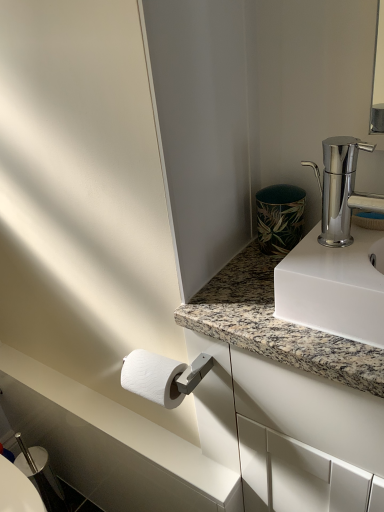
Identify the location of silver metallic bidet at lower left. The image size is (384, 512). (17, 490).

What do you see at coordinates (110, 445) in the screenshot? I see `white marble countertop at lower left` at bounding box center [110, 445].

Where is `green leaf-patterned ceramic at upper right`? The image size is (384, 512). green leaf-patterned ceramic at upper right is located at coordinates (279, 218).

Choose the correct answer: Is white marble countertop at lower left inside silver metallic bidet at lower left or outside it?

white marble countertop at lower left cannot be found inside silver metallic bidet at lower left.

Does white marble countertop at lower left have a greater height compared to silver metallic bidet at lower left?

Incorrect, the height of white marble countertop at lower left is not larger of that of silver metallic bidet at lower left.

I want to click on counter top positioned vertically above the silver metallic bidet at lower left (from a real-world perspective), so click(x=110, y=445).

From a real-world perspective, who is located higher, white marble countertop at lower left or silver metallic bidet at lower left?

white marble countertop at lower left.

From the image's perspective, is white textured toilet paper at lower left above green leaf-patterned ceramic at upper right?

Actually, white textured toilet paper at lower left appears below green leaf-patterned ceramic at upper right in the image.

Does white textured toilet paper at lower left have a greater width compared to green leaf-patterned ceramic at upper right?

Yes.

Is white textured toilet paper at lower left smaller than green leaf-patterned ceramic at upper right?

Yes, white textured toilet paper at lower left is smaller than green leaf-patterned ceramic at upper right.

Locate an element on the screen. The image size is (384, 512). toilet paper above the granite at upper right (from the image's perspective) is located at coordinates (153, 377).

Is white textured toilet paper at lower left located outside granite at upper right?

Yes, white textured toilet paper at lower left is outside of granite at upper right.

In the scene shown: Does white textured toilet paper at lower left have a greater height compared to granite at upper right?

Incorrect, the height of white textured toilet paper at lower left is not larger of that of granite at upper right.

Considering the relative sizes of white textured toilet paper at lower left and granite at upper right in the image provided, is white textured toilet paper at lower left bigger than granite at upper right?

Incorrect, white textured toilet paper at lower left is not larger than granite at upper right.

Is point (294, 186) positioned before point (127, 360)?

No, (294, 186) is further to viewer.

What's the angular difference between green leaf-patterned ceramic at upper right and white textured toilet paper at lower left's facing directions?

The angle between the facing direction of green leaf-patterned ceramic at upper right and the facing direction of white textured toilet paper at lower left is 90 degrees.

Considering the relative positions of green leaf-patterned ceramic at upper right and white textured toilet paper at lower left in the image provided, is green leaf-patterned ceramic at upper right behind white textured toilet paper at lower left?

Yes, green leaf-patterned ceramic at upper right is further from the camera.

Is green leaf-patterned ceramic at upper right positioned with its back to white textured toilet paper at lower left?

green leaf-patterned ceramic at upper right does not have its back to white textured toilet paper at lower left.

This screenshot has height=512, width=384. Find the location of `appliance below the polished chrome faucet at upper right (from the image's perspective)`. appliance below the polished chrome faucet at upper right (from the image's perspective) is located at coordinates click(x=279, y=218).

Is green leaf-patterned ceramic at upper right directly adjacent to polished chrome faucet at upper right?

No, green leaf-patterned ceramic at upper right is not touching polished chrome faucet at upper right.

In terms of width, does green leaf-patterned ceramic at upper right look wider or thinner when compared to polished chrome faucet at upper right?

green leaf-patterned ceramic at upper right is wider than polished chrome faucet at upper right.

Which object is positioned more to the right, green leaf-patterned ceramic at upper right or polished chrome faucet at upper right?

polished chrome faucet at upper right.

Where is `counter top below the white textured toilet paper at lower left (from the image's perspective)`? The width and height of the screenshot is (384, 512). counter top below the white textured toilet paper at lower left (from the image's perspective) is located at coordinates (110, 445).

Which of these two, white marble countertop at lower left or white textured toilet paper at lower left, is bigger?

With larger size is white textured toilet paper at lower left.

Could you tell me if white marble countertop at lower left is turned towards white textured toilet paper at lower left?

No.

Considering the positions of objects white marble countertop at lower left and white textured toilet paper at lower left in the image provided, who is more to the left, white marble countertop at lower left or white textured toilet paper at lower left?

From the viewer's perspective, white marble countertop at lower left appears more on the left side.

From their relative heights in the image, would you say white marble countertop at lower left is taller or shorter than green leaf-patterned ceramic at upper right?

white marble countertop at lower left is shorter than green leaf-patterned ceramic at upper right.

Is white marble countertop at lower left surrounding green leaf-patterned ceramic at upper right?

That's incorrect, green leaf-patterned ceramic at upper right is not inside white marble countertop at lower left.

Does white marble countertop at lower left appear on the left side of green leaf-patterned ceramic at upper right?

Yes.

Considering their positions, is white marble countertop at lower left located in front of or behind green leaf-patterned ceramic at upper right?

white marble countertop at lower left is behind green leaf-patterned ceramic at upper right.

This screenshot has width=384, height=512. What are the coordinates of `bidet that appears below the white marble countertop at lower left (from the image's perspective)` in the screenshot? It's located at (17, 490).

Locate an element on the screen. This screenshot has height=512, width=384. appliance behind the white textured toilet paper at lower left is located at coordinates (279, 218).

Considering their positions, is white textured toilet paper at lower left positioned closer to green leaf-patterned ceramic at upper right than polished chrome faucet at upper right?

polished chrome faucet at upper right is closer to green leaf-patterned ceramic at upper right.

In the scene shown: From the image, which object appears to be farther from green leaf-patterned ceramic at upper right, white textured toilet paper at lower left or silver metallic bidet at lower left?

Based on the image, silver metallic bidet at lower left appears to be further to green leaf-patterned ceramic at upper right.

From the image, which object appears to be nearer to green leaf-patterned ceramic at upper right, polished chrome faucet at upper right or granite at upper right?

polished chrome faucet at upper right is closer to green leaf-patterned ceramic at upper right.

Looking at this image, based on their spatial positions, is white textured toilet paper at lower left or white marble countertop at lower left further from granite at upper right?

white marble countertop at lower left lies further to granite at upper right than the other object.

From the image, which object appears to be nearer to granite at upper right, white marble countertop at lower left or polished chrome faucet at upper right?

polished chrome faucet at upper right is closer to granite at upper right.

Based on their spatial positions, is silver metallic bidet at lower left or green leaf-patterned ceramic at upper right further from white marble countertop at lower left?

The object further to white marble countertop at lower left is green leaf-patterned ceramic at upper right.

Which object lies nearer to the anchor point silver metallic bidet at lower left, granite at upper right or polished chrome faucet at upper right?

granite at upper right is closer to silver metallic bidet at lower left.

Estimate the real-world distances between objects in this image. Which object is closer to polished chrome faucet at upper right, white textured toilet paper at lower left or silver metallic bidet at lower left?

Among the two, white textured toilet paper at lower left is located nearer to polished chrome faucet at upper right.

Where is `toilet paper between green leaf-patterned ceramic at upper right and white marble countertop at lower left in the vertical direction`? toilet paper between green leaf-patterned ceramic at upper right and white marble countertop at lower left in the vertical direction is located at coordinates (153, 377).

Find the location of a particular element. The image size is (384, 512). toilet paper between polished chrome faucet at upper right and granite at upper right in the up-down direction is located at coordinates click(x=153, y=377).

This screenshot has height=512, width=384. In order to click on appliance between polished chrome faucet at upper right and granite at upper right vertically in this screenshot , I will do `click(279, 218)`.

Locate an element on the screen. The image size is (384, 512). toilet paper situated between white marble countertop at lower left and granite at upper right from left to right is located at coordinates (153, 377).